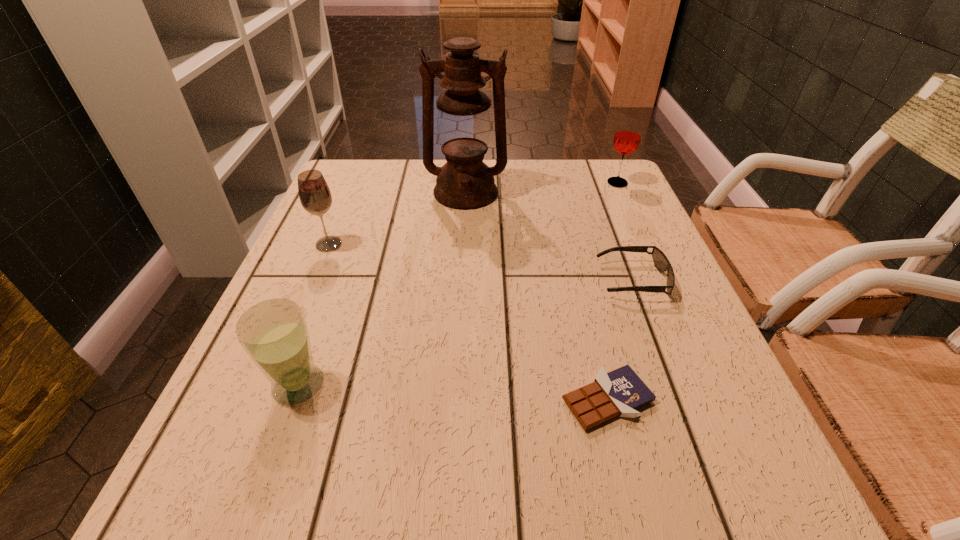
Where is `the closest glass to the rightmost glass`? This screenshot has height=540, width=960. the closest glass to the rightmost glass is located at coordinates (314, 194).

Point out which glass is positioned as the nearest to the third farthest object. Please provide its 2D coordinates. Your answer should be formatted as a tuple, i.e. [(x, y)], where the tuple contains the x and y coordinates of a point satisfying the conditions above.

[(274, 333)]

The height and width of the screenshot is (540, 960). I want to click on free region that satisfies the following two spatial constraints: 1. on the front side of the second nearest glass; 2. on the left side of the chocolate bar, so click(x=265, y=400).